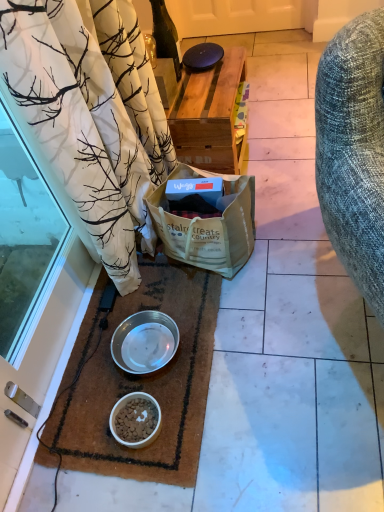
Where is `free spot to the right of transparent glass door at lower left`? The width and height of the screenshot is (384, 512). free spot to the right of transparent glass door at lower left is located at coordinates (135, 325).